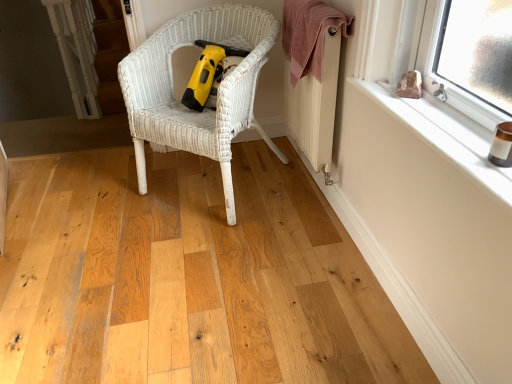
Measure the distance between point (x=130, y=70) and camera.

Point (x=130, y=70) is 1.77 meters from camera.

The image size is (512, 384). What do you see at coordinates (315, 106) in the screenshot? I see `white textured radiator at upper right` at bounding box center [315, 106].

Image resolution: width=512 pixels, height=384 pixels. Describe the element at coordinates (210, 73) in the screenshot. I see `yellow plastic vacuum at center` at that location.

Locate an element on the screen. The width and height of the screenshot is (512, 384). white painted wood at upper right is located at coordinates (443, 136).

Identify the location of pink towel at upper right. (309, 35).

Which object is positioned more to the left, white textured radiator at upper right or white painted wood at upper right?

Positioned to the left is white textured radiator at upper right.

Is white textured radiator at upper right further to camera compared to white painted wood at upper right?

Yes, it is.

Is white textured radiator at upper right smaller than pink towel at upper right?

No, white textured radiator at upper right is not smaller than pink towel at upper right.

From a real-world perspective, is white textured radiator at upper right physically located above or below pink towel at upper right?

white textured radiator at upper right is situated lower than pink towel at upper right in the real world.

Consider the image. Could you tell me if white textured radiator at upper right is facing pink towel at upper right?

Yes, white textured radiator at upper right is facing pink towel at upper right.

From the image's perspective, between white textured radiator at upper right and pink towel at upper right, which one is located above?

From the image's view, pink towel at upper right is above.

Considering the positions of points (190, 11) and (313, 37), is point (190, 11) closer to camera compared to point (313, 37)?

No, it is not.

Which object is positioned more to the right, white wicker chair at center or pink towel at upper right?

pink towel at upper right.

Locate an element on the screen. chair on the left of pink towel at upper right is located at coordinates [179, 100].

Is pink towel at upper right located within white wicker chair at center?

That's incorrect, pink towel at upper right is not inside white wicker chair at center.

Is yellow plastic vacuum at center not near white textured radiator at upper right?

That's not correct — yellow plastic vacuum at center is a little close to white textured radiator at upper right.

Is point (203, 69) behind point (318, 125)?

That is True.

Considering the relative sizes of yellow plastic vacuum at center and white textured radiator at upper right in the image provided, is yellow plastic vacuum at center smaller than white textured radiator at upper right?

Correct, yellow plastic vacuum at center occupies less space than white textured radiator at upper right.

Which of these two, white painted wood at upper right or yellow plastic vacuum at center, stands shorter?

With less height is white painted wood at upper right.

Is white painted wood at upper right positioned before yellow plastic vacuum at center?

That is True.

Is white painted wood at upper right with yellow plastic vacuum at center?

No, white painted wood at upper right is not beside yellow plastic vacuum at center.

From the image's perspective, is white painted wood at upper right above yellow plastic vacuum at center?

No, from the image's perspective, white painted wood at upper right is not over yellow plastic vacuum at center.

Is white wicker chair at center not inside yellow plastic vacuum at center?

Yes.

Is the position of white wicker chair at center more distant than that of yellow plastic vacuum at center?

No, it is not.

Considering the relative positions of white wicker chair at center and yellow plastic vacuum at center in the image provided, is white wicker chair at center to the left or to the right of yellow plastic vacuum at center?

white wicker chair at center is to the left of yellow plastic vacuum at center.

Is point (236, 101) in front of point (210, 67)?

Yes, point (236, 101) is closer to viewer.

Is pink towel at upper right aimed at white wicker chair at center?

Yes, pink towel at upper right is turned towards white wicker chair at center.

From the image's perspective, is pink towel at upper right above or below white wicker chair at center?

pink towel at upper right is above white wicker chair at center.

Considering the sizes of pink towel at upper right and white wicker chair at center in the image, is pink towel at upper right taller or shorter than white wicker chair at center?

Considering their sizes, pink towel at upper right has less height than white wicker chair at center.

You are a GUI agent. You are given a task and a screenshot of the screen. Output one action in this format:
    pyautogui.click(x=<x>, y=<y>)
    Task: Click on the window sill that is above the white textured radiator at upper right (from a real-world perspective)
    
    Given the screenshot: What is the action you would take?
    pyautogui.click(x=443, y=136)

The image size is (512, 384). In the image, there is a pink towel at upper right. Find the location of `radiator below it (from the image's perspective)`. radiator below it (from the image's perspective) is located at coordinates (315, 106).

Considering their positions, is white textured radiator at upper right positioned closer to white wicker chair at center than pink towel at upper right?

Based on the image, pink towel at upper right appears to be nearer to white wicker chair at center.

Considering their positions, is white wicker chair at center positioned closer to white painted wood at upper right than pink towel at upper right?

pink towel at upper right is positioned closer to the anchor white painted wood at upper right.

Based on the photo, when comparing their distances from white painted wood at upper right, does pink towel at upper right or white wicker chair at center seem closer?

The object closer to white painted wood at upper right is pink towel at upper right.

Which object lies nearer to the anchor point pink towel at upper right, white painted wood at upper right or yellow plastic vacuum at center?

Based on the image, yellow plastic vacuum at center appears to be nearer to pink towel at upper right.

When comparing their distances from white wicker chair at center, does pink towel at upper right or white painted wood at upper right seem further?

white painted wood at upper right is positioned further to the anchor white wicker chair at center.

Looking at the image, which one is located further to white painted wood at upper right, white wicker chair at center or yellow plastic vacuum at center?

Based on the image, yellow plastic vacuum at center appears to be further to white painted wood at upper right.

Estimate the real-world distances between objects in this image. Which object is closer to white painted wood at upper right, white textured radiator at upper right or white wicker chair at center?

white textured radiator at upper right lies closer to white painted wood at upper right than the other object.

Based on their spatial positions, is white textured radiator at upper right or pink towel at upper right closer to white painted wood at upper right?

The object closer to white painted wood at upper right is pink towel at upper right.

Identify the location of radiator between white painted wood at upper right and yellow plastic vacuum at center along the z-axis. The width and height of the screenshot is (512, 384). (315, 106).

The width and height of the screenshot is (512, 384). Find the location of `vacuum situated between white wicker chair at center and white textured radiator at upper right from left to right`. vacuum situated between white wicker chair at center and white textured radiator at upper right from left to right is located at coordinates (210, 73).

I want to click on blanket between white painted wood at upper right and white textured radiator at upper right in the front-back direction, so click(x=309, y=35).

You are a GUI agent. You are given a task and a screenshot of the screen. Output one action in this format:
    pyautogui.click(x=<x>, y=<y>)
    Task: Click on the blanket positioned between white painted wood at upper right and yellow plastic vacuum at center from near to far
    
    Given the screenshot: What is the action you would take?
    pyautogui.click(x=309, y=35)